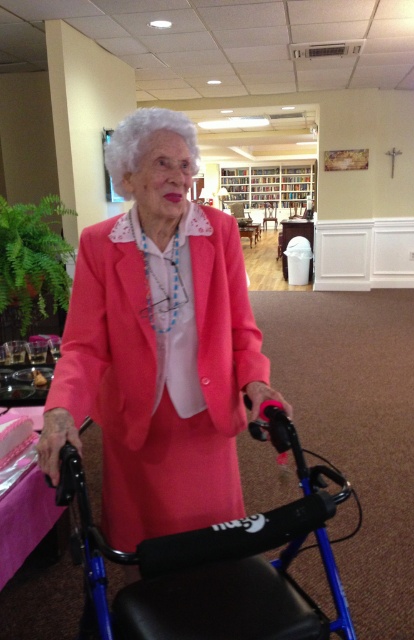
You are an interior designer observing the scene. You need to place a new decorative item between the pink matte jacket at center and the wooden bookshelf at upper center. Which object should the item be placed closer to, based on their positions?

The decorative item should be placed closer to the wooden bookshelf at upper center because the pink matte jacket at center is closer to the viewer, meaning the bookshelf is farther back, so placing the item closer to the bookshelf would maintain spatial balance.

You are an elderly woman standing at point (216, 563) using a blue plastic walker at center. You want to move to the bookshelves in the background. Which direction should you move to reach the bookshelves?

The blue plastic walker at center is located at point (216, 563). To reach the bookshelves in the background, you should move forward since the bookshelves are positioned behind the current location of the blue plastic walker at center.